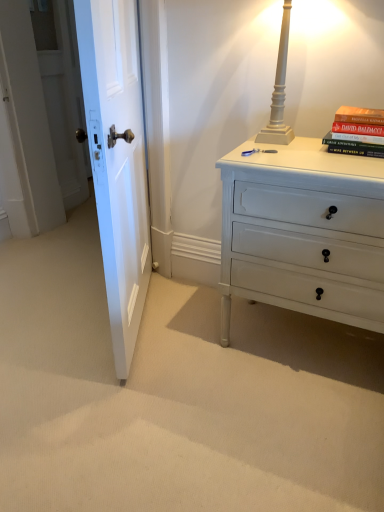
Question: Does white painted wood chest of drawers at right have a larger size compared to hardcover book at upper right?

Choices:
 (A) yes
 (B) no

Answer: (A)

Question: Is white painted wood chest of drawers at right closer to camera compared to hardcover book at upper right?

Choices:
 (A) yes
 (B) no

Answer: (A)

Question: Is white painted wood chest of drawers at right wider than hardcover book at upper right?

Choices:
 (A) no
 (B) yes

Answer: (B)

Question: Is white painted wood chest of drawers at right taller than hardcover book at upper right?

Choices:
 (A) yes
 (B) no

Answer: (A)

Question: Is white painted wood chest of drawers at right at the right side of hardcover book at upper right?

Choices:
 (A) yes
 (B) no

Answer: (B)

Question: Considering the positions of white wooden door at left and white painted wood chest of drawers at right in the image, is white wooden door at left bigger or smaller than white painted wood chest of drawers at right?

Choices:
 (A) big
 (B) small

Answer: (B)

Question: Which is correct: white wooden door at left is inside white painted wood chest of drawers at right, or outside of it?

Choices:
 (A) outside
 (B) inside

Answer: (A)

Question: From the image's perspective, is white wooden door at left positioned above or below white painted wood chest of drawers at right?

Choices:
 (A) above
 (B) below

Answer: (A)

Question: Visually, is white wooden door at left positioned to the left or to the right of white painted wood chest of drawers at right?

Choices:
 (A) right
 (B) left

Answer: (B)

Question: Is white wooden door at left inside or outside of hardcover book at upper right?

Choices:
 (A) outside
 (B) inside

Answer: (A)

Question: Considering their positions, is white wooden door at left located in front of or behind hardcover book at upper right?

Choices:
 (A) behind
 (B) front

Answer: (B)

Question: Is white wooden door at left taller or shorter than hardcover book at upper right?

Choices:
 (A) tall
 (B) short

Answer: (A)

Question: Considering the positions of white wooden door at left and hardcover book at upper right in the image, is white wooden door at left wider or thinner than hardcover book at upper right?

Choices:
 (A) thin
 (B) wide

Answer: (A)

Question: Considering their positions, is white painted wood chest of drawers at right located in front of or behind white painted wood table lamp at upper right?

Choices:
 (A) front
 (B) behind

Answer: (A)

Question: In the image, is white painted wood chest of drawers at right on the left side or the right side of white painted wood table lamp at upper right?

Choices:
 (A) left
 (B) right

Answer: (B)